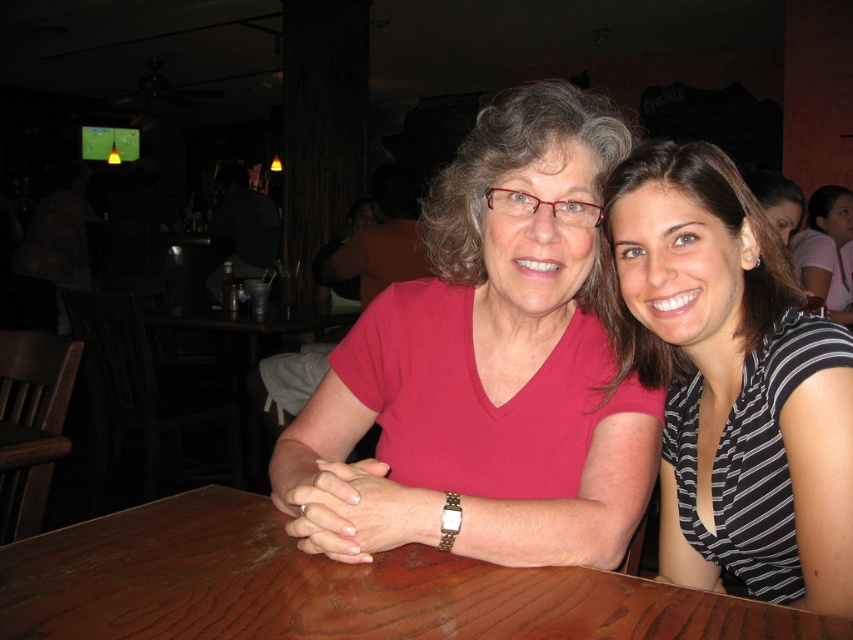
Question: Which point is closer to the camera taking this photo?

Choices:
 (A) (524, 364)
 (B) (247, 531)

Answer: (B)

Question: From the image, what is the correct spatial relationship of striped fabric shirt at center in relation to brown wood table at center?

Choices:
 (A) below
 (B) above

Answer: (B)

Question: Which of the following is the closest to the observer?

Choices:
 (A) matte pink shirt at center
 (B) brown wood table at center
 (C) striped fabric shirt at center

Answer: (B)

Question: Is matte pink shirt at center thinner than striped fabric shirt at center?

Choices:
 (A) no
 (B) yes

Answer: (A)

Question: Can you confirm if striped fabric shirt at center is wider than brown wood table at center?

Choices:
 (A) no
 (B) yes

Answer: (A)

Question: Considering the real-world distances, which object is closest to the striped fabric shirt at center?

Choices:
 (A) matte pink shirt at center
 (B) brown wood table at center

Answer: (A)